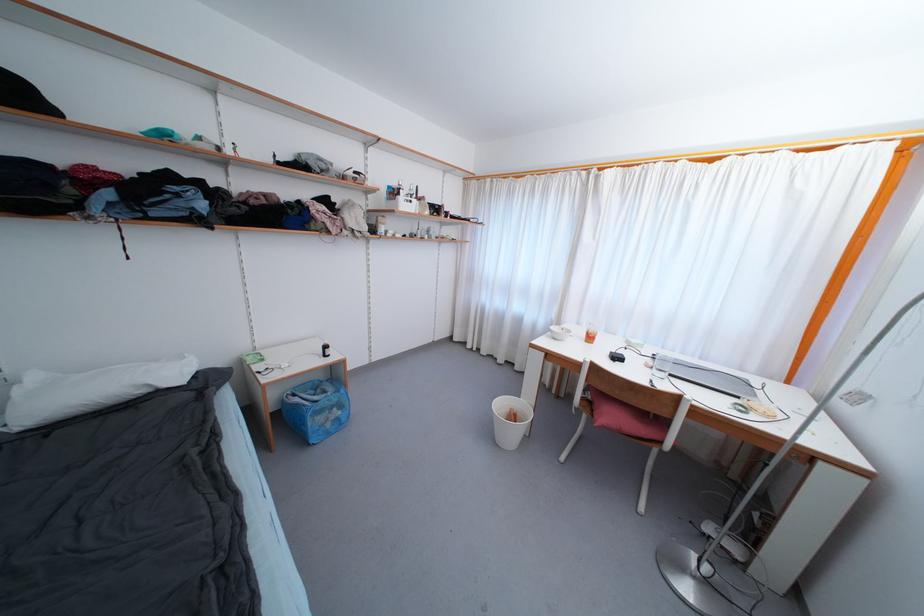
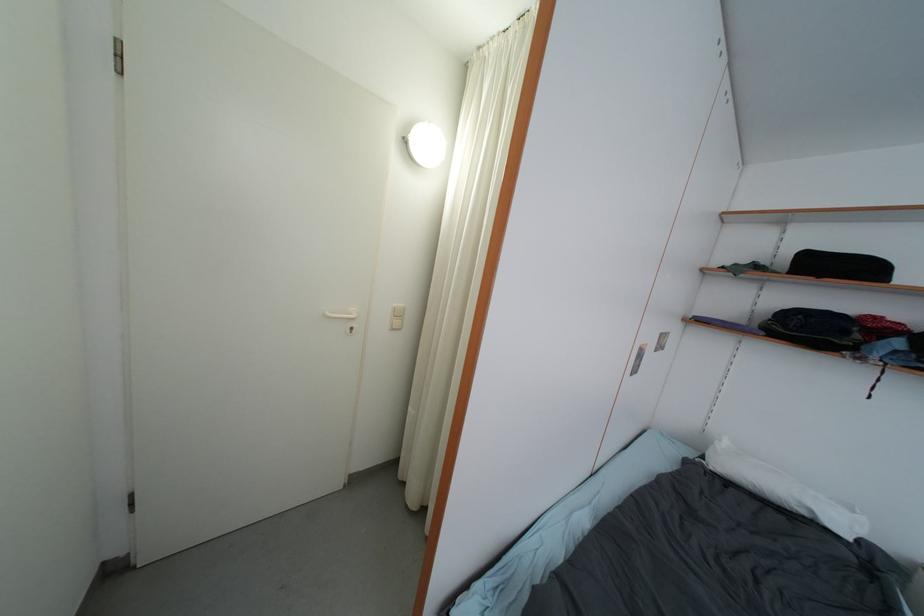
Question: The camera is either moving clockwise (left) or counter-clockwise (right) around the object. The first image is from the beginning of the video and the second image is from the end. Is the camera moving left or right when shooting the video?

Choices:
 (A) Left
 (B) Right

Answer: (B)